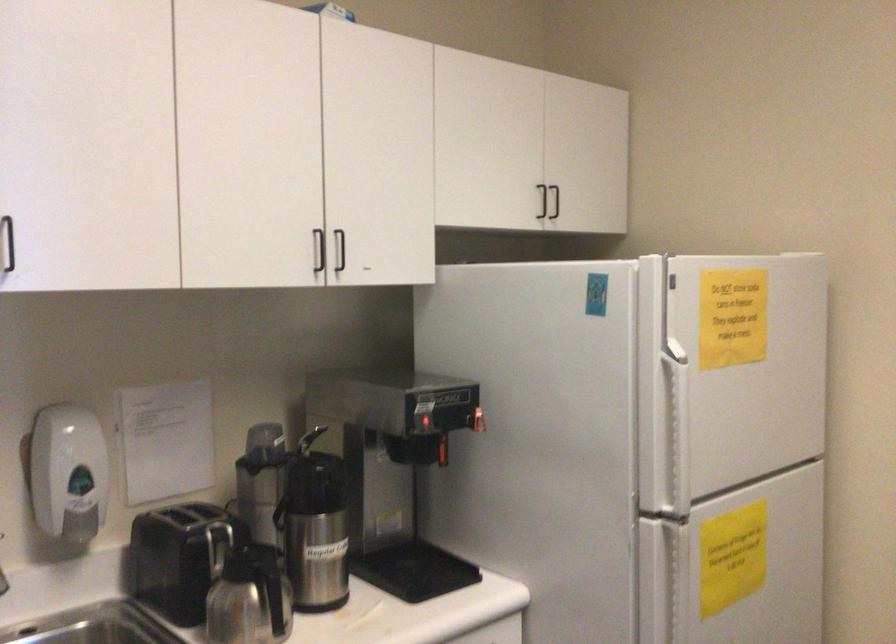
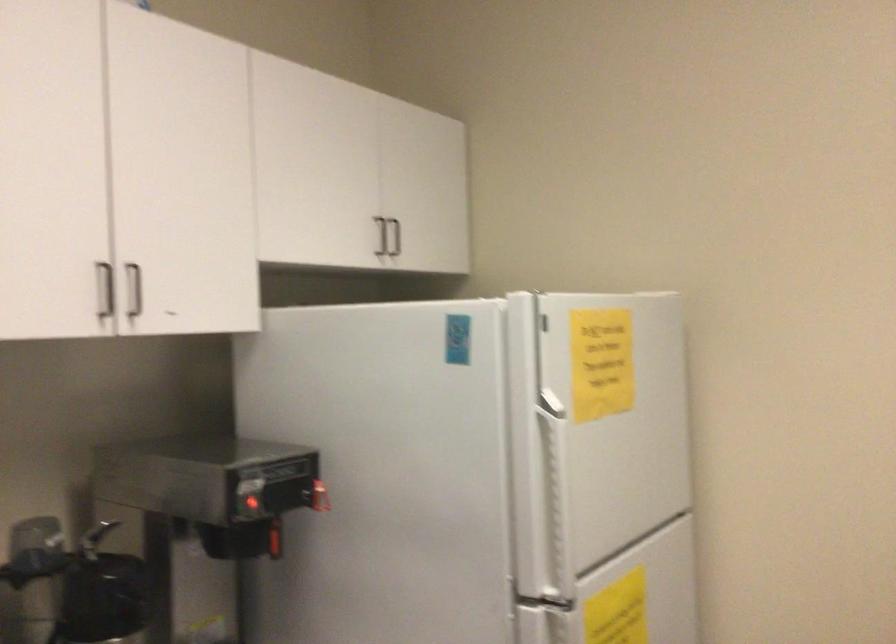
The point at (314, 252) is marked in the first image. Where is the corresponding point in the second image?

(105, 290)